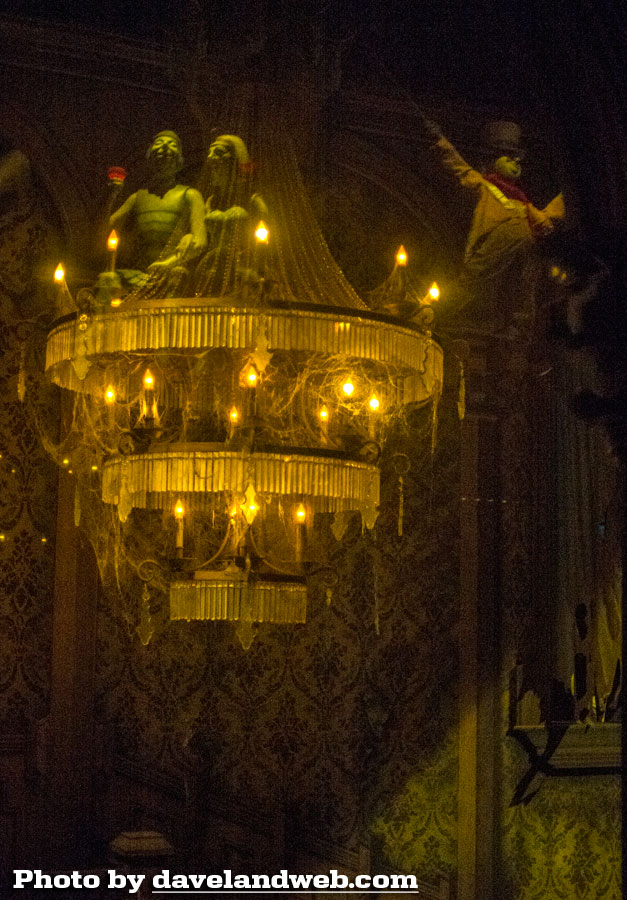
The width and height of the screenshot is (627, 900). I want to click on light, so [x=313, y=312], [x=291, y=465], [x=261, y=608].